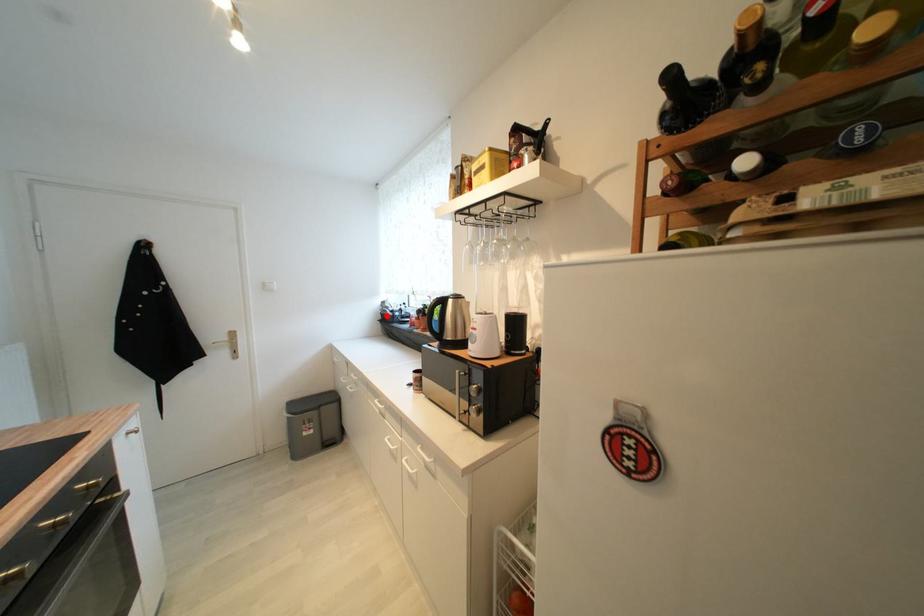
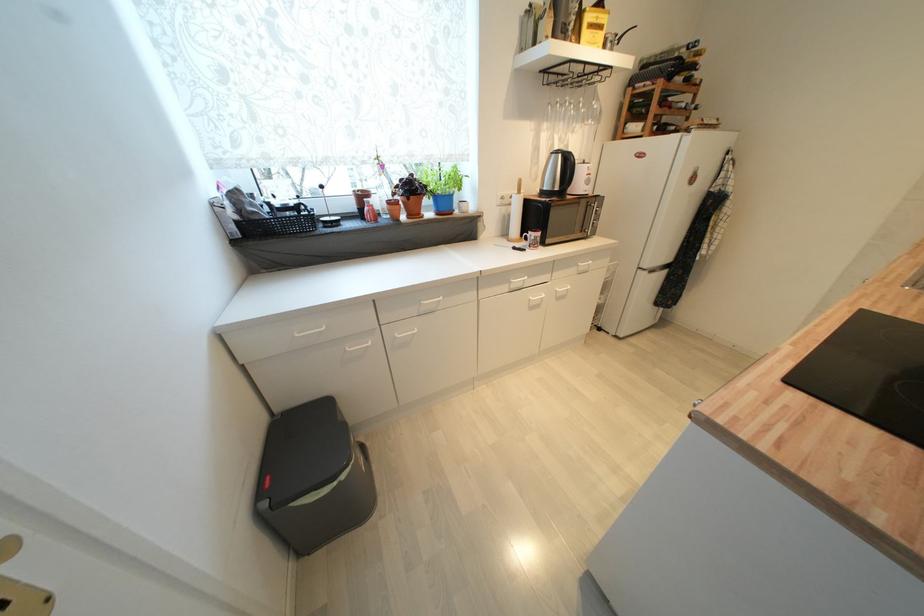
Where in the second image is the point corresponding to the highlighted location from the first image?

(242, 225)